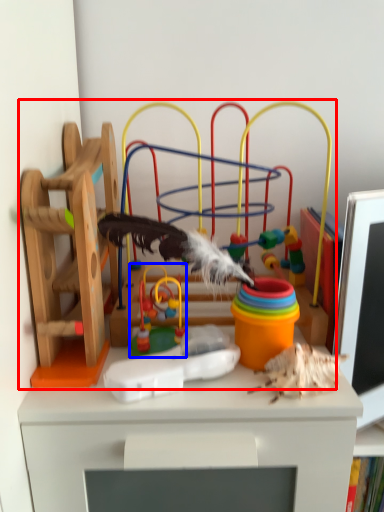
Question: Which object is further to the camera taking this photo, toy (highlighted by a red box) or toy (highlighted by a blue box)?

Choices:
 (A) toy
 (B) toy

Answer: (B)